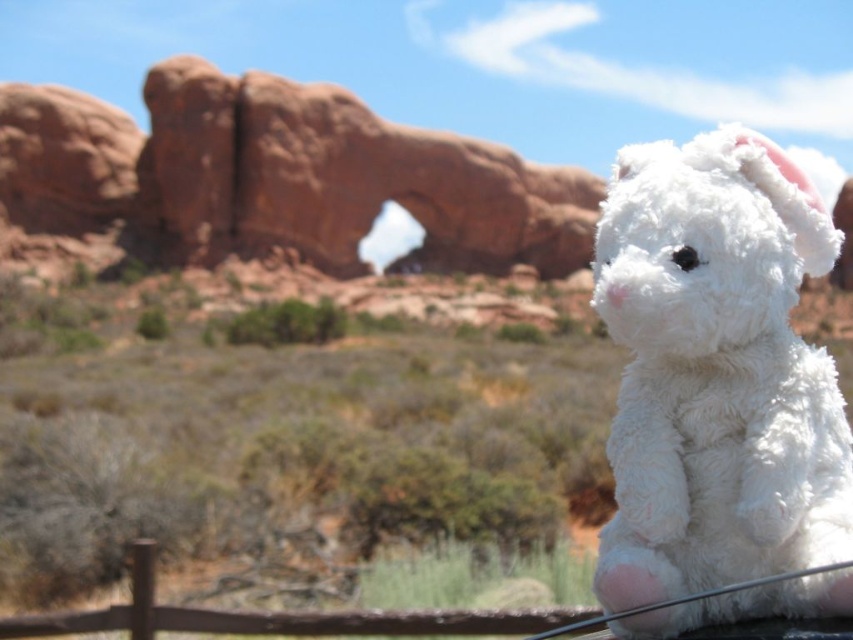
Question: Can you confirm if rustic sandstone arch at center is positioned above brown wooden fence at lower center?

Choices:
 (A) yes
 (B) no

Answer: (A)

Question: Where is rustic sandstone arch at center located in relation to brown wooden fence at lower center in the image?

Choices:
 (A) below
 (B) above

Answer: (B)

Question: Estimate the real-world distances between objects in this image. Which object is closer to the brown wooden fence at lower center?

Choices:
 (A) rustic sandstone arch at center
 (B) white fluffy stuffed animal at right

Answer: (B)

Question: Which point is farther to the camera?

Choices:
 (A) brown wooden fence at lower center
 (B) white fluffy stuffed animal at right
 (C) rustic sandstone arch at center

Answer: (C)

Question: Which point is closer to the camera?

Choices:
 (A) (33, 148)
 (B) (236, 621)
 (C) (668, 419)

Answer: (C)

Question: From the image, what is the correct spatial relationship of white fluffy stuffed animal at right in relation to rustic sandstone arch at center?

Choices:
 (A) right
 (B) left

Answer: (A)